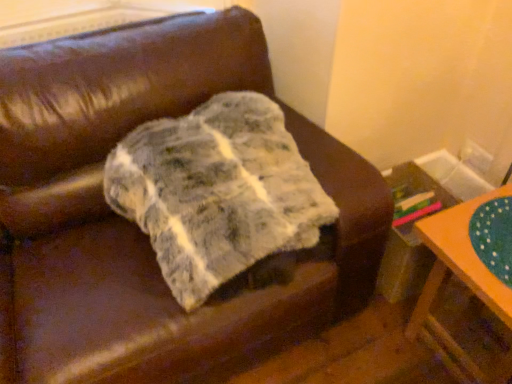
Question: Is marble-like fabric at center to the left or to the right of orange painted wood table at lower right in the image?

Choices:
 (A) right
 (B) left

Answer: (B)

Question: Is marble-like fabric at center taller or shorter than orange painted wood table at lower right?

Choices:
 (A) short
 (B) tall

Answer: (A)

Question: Is marble-like fabric at center in front of or behind orange painted wood table at lower right in the image?

Choices:
 (A) front
 (B) behind

Answer: (A)

Question: In terms of height, does orange painted wood table at lower right look taller or shorter compared to marble-like fabric at center?

Choices:
 (A) short
 (B) tall

Answer: (B)

Question: In the image, is orange painted wood table at lower right positioned in front of or behind marble-like fabric at center?

Choices:
 (A) front
 (B) behind

Answer: (B)

Question: Is point (430, 291) closer or farther from the camera than point (288, 145)?

Choices:
 (A) farther
 (B) closer

Answer: (A)

Question: From the image's perspective, is orange painted wood table at lower right above or below marble-like fabric at center?

Choices:
 (A) below
 (B) above

Answer: (A)